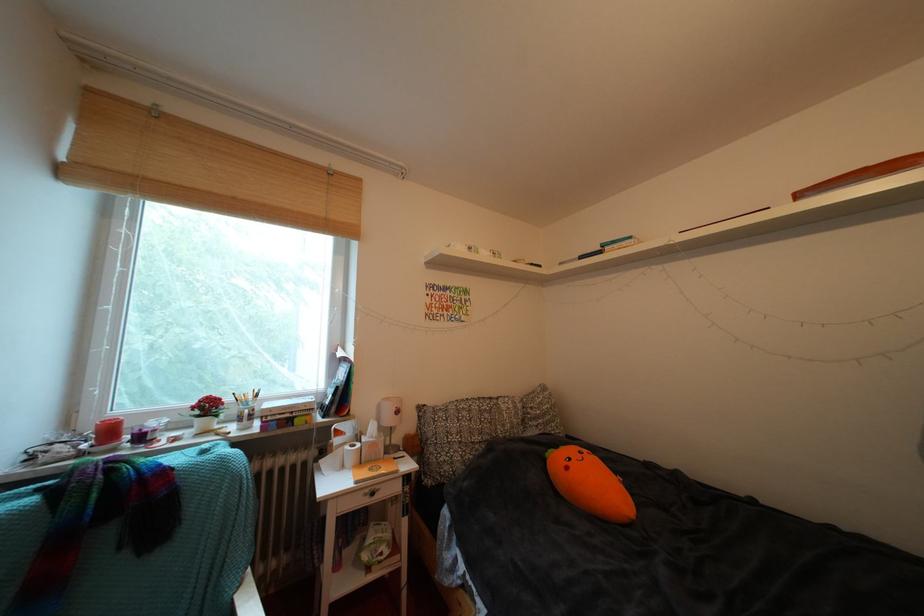
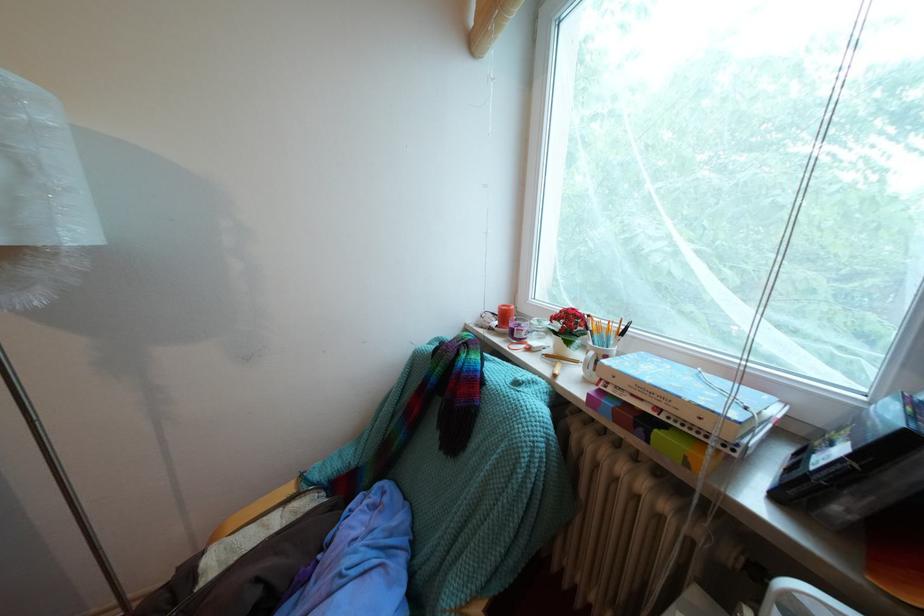
Find the pixel in the second image that matches (302,418) in the first image.

(669, 415)